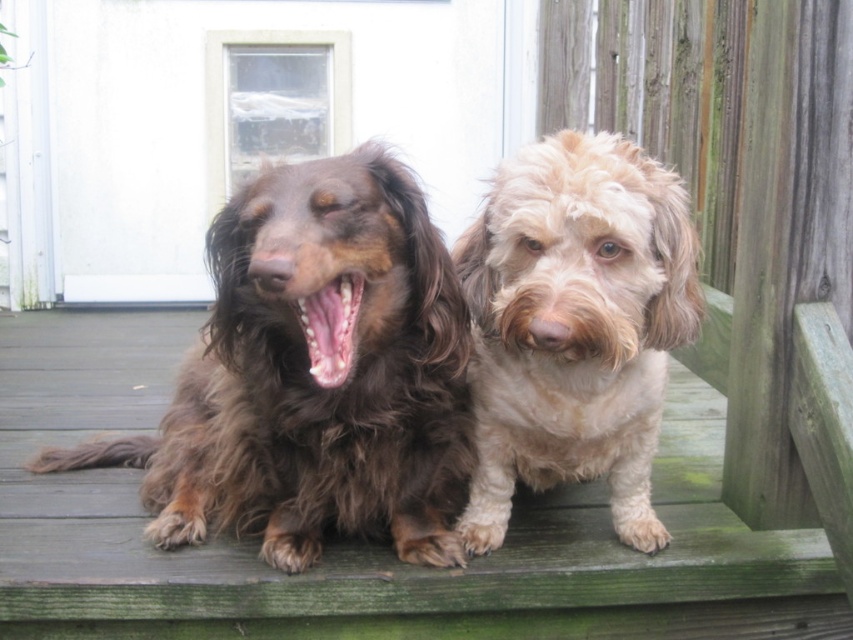
Can you confirm if brown shaggy dog at center is shorter than bright pink glossy teeth at center?

No, brown shaggy dog at center is not shorter than bright pink glossy teeth at center.

Does brown shaggy dog at center appear on the right side of bright pink glossy teeth at center?

In fact, brown shaggy dog at center is to the left of bright pink glossy teeth at center.

Locate an element on the screen. brown shaggy dog at center is located at coordinates (312, 378).

Does point (51, 608) lie in front of point (463, 342)?

No.

Is the position of green wood deck at center more distant than that of brown shaggy dog at center?

Yes, it is behind brown shaggy dog at center.

What are the coordinates of `green wood deck at center` in the screenshot? It's located at (364, 544).

The image size is (853, 640). What are the coordinates of `green wood deck at center` in the screenshot? It's located at (364, 544).

Which is above, white fluffy dog at center or bright pink glossy teeth at center?

bright pink glossy teeth at center is higher up.

Is white fluffy dog at center below bright pink glossy teeth at center?

Correct, white fluffy dog at center is located below bright pink glossy teeth at center.

Which is behind, point (550, 397) or point (347, 337)?

Positioned behind is point (550, 397).

Image resolution: width=853 pixels, height=640 pixels. I want to click on white fluffy dog at center, so click(573, 324).